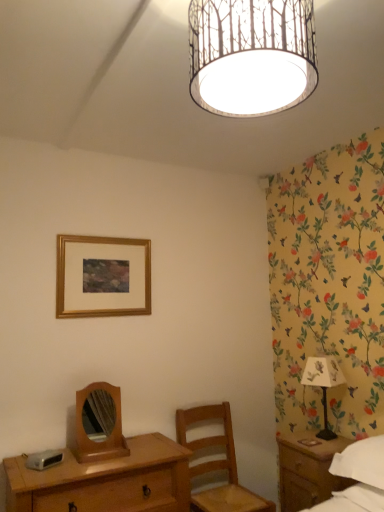
Question: In the image, is wooden chair at center positioned in front of or behind wooden mirror at center?

Choices:
 (A) behind
 (B) front

Answer: (A)

Question: Considering the positions of wooden chair at center and wooden mirror at center in the image, is wooden chair at center bigger or smaller than wooden mirror at center?

Choices:
 (A) big
 (B) small

Answer: (A)

Question: Considering the real-world distances, which object is farthest from the wooden mirror at center?

Choices:
 (A) wooden chair at center
 (B) gold wooden picture frame at upper center
 (C) wooden desk at lower left
 (D) white paper with tree pattern at upper center
 (E) white fabric lampshade at right

Answer: (D)

Question: Considering the real-world distances, which object is closest to the white fabric lampshade at right?

Choices:
 (A) wooden chair at center
 (B) wooden desk at lower left
 (C) gold wooden picture frame at upper center
 (D) white paper with tree pattern at upper center
 (E) wooden mirror at center

Answer: (A)